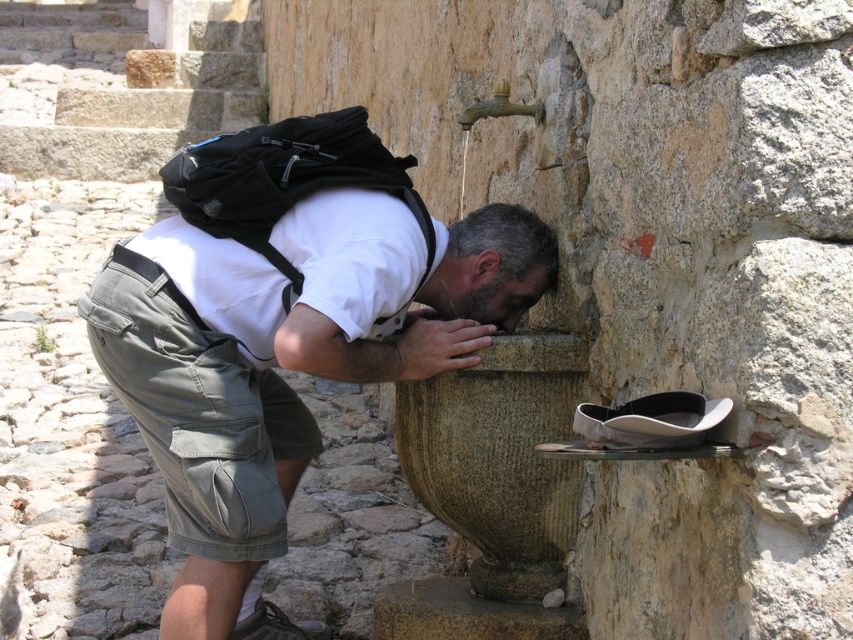
Is matte khaki shorts at lower left shorter than black suede shoe at lower center?

No, matte khaki shorts at lower left is not shorter than black suede shoe at lower center.

The image size is (853, 640). What are the coordinates of `matte khaki shorts at lower left` in the screenshot? It's located at (286, 358).

Does point (164, 282) come behind point (305, 634)?

No, it is in front of (305, 634).

What are the coordinates of `matte khaki shorts at lower left` in the screenshot? It's located at (286, 358).